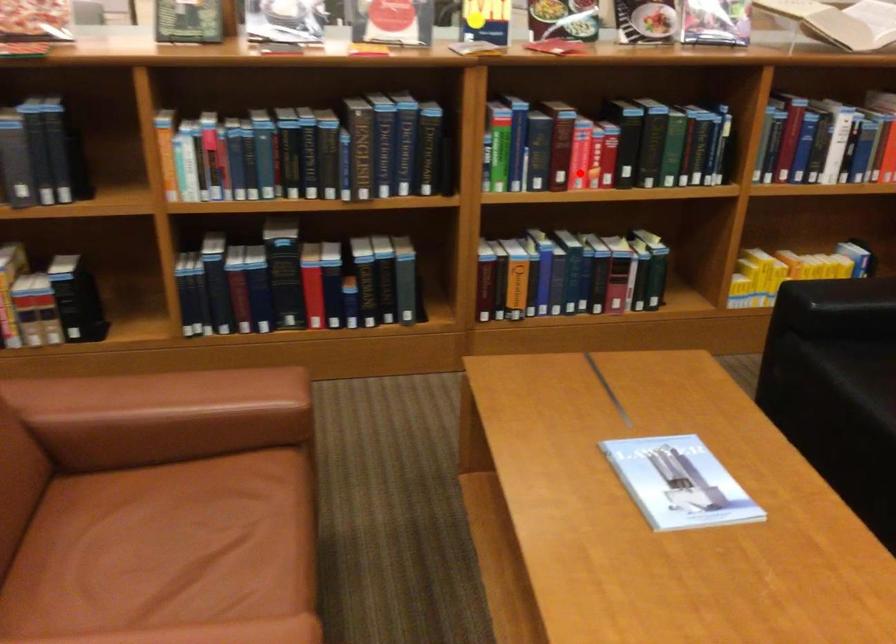
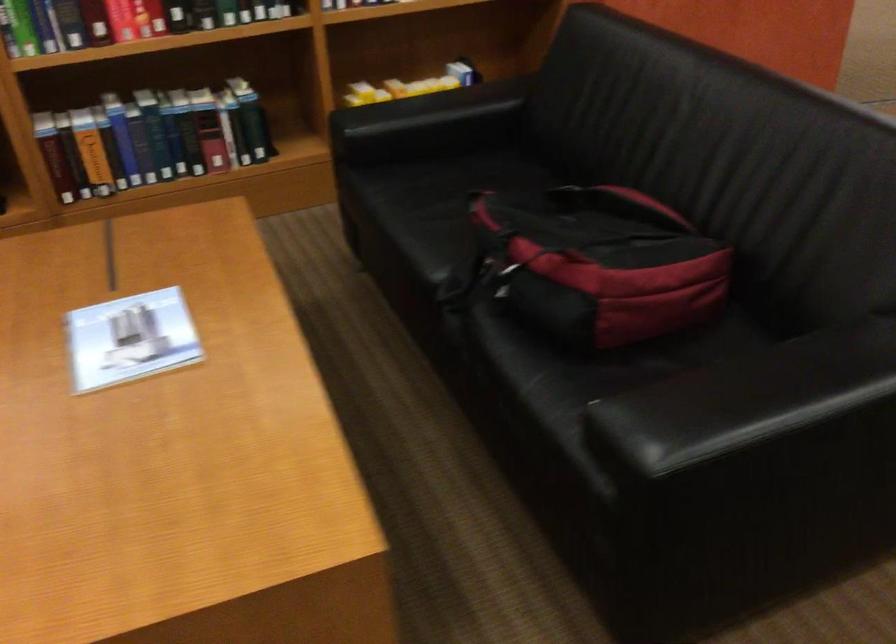
In the second image, find the point that corresponds to the highlighted location in the first image.

(123, 21)